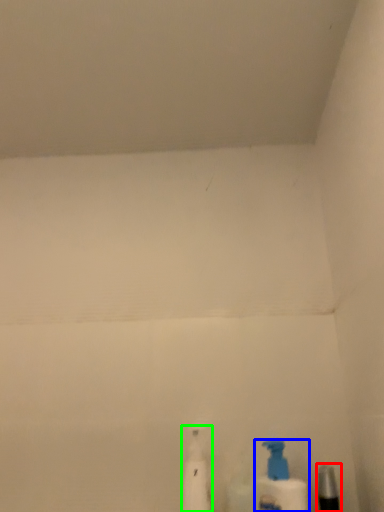
Question: Which object is positioned farthest from toiletry (highlighted by a red box)? Select from bottle (highlighted by a blue box) and cleaning product (highlighted by a green box).

Choices:
 (A) bottle
 (B) cleaning product

Answer: (B)